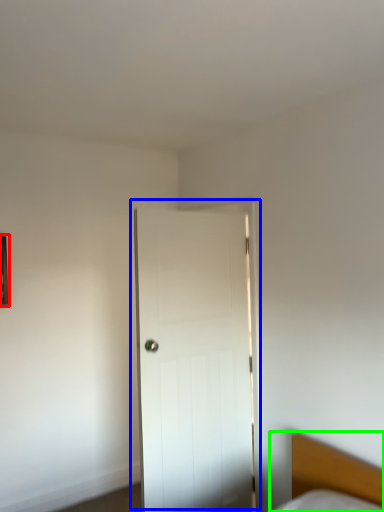
Question: Based on their relative distances, which object is nearer to picture frame (highlighted by a red box)? Choose from door (highlighted by a blue box) and bed (highlighted by a green box).

Choices:
 (A) door
 (B) bed

Answer: (A)